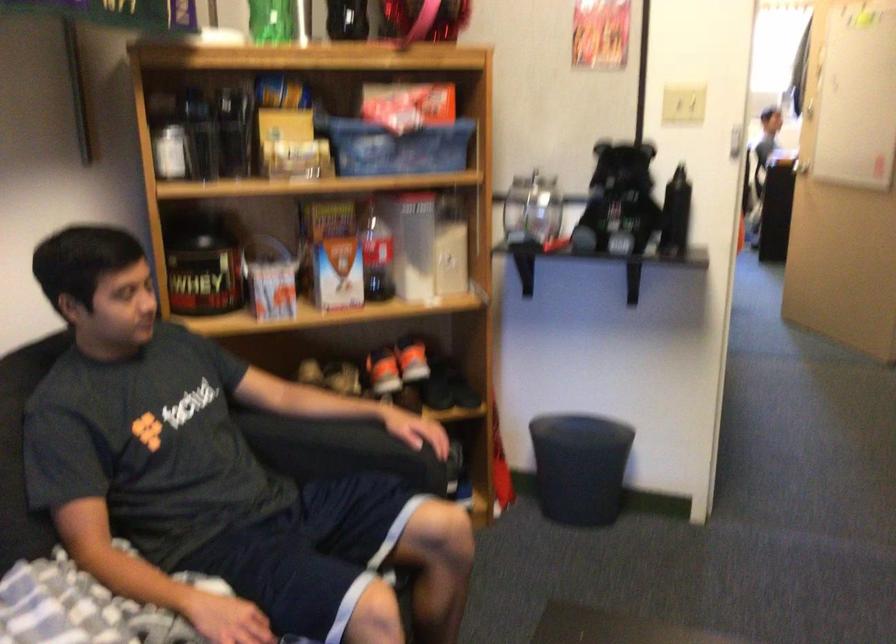
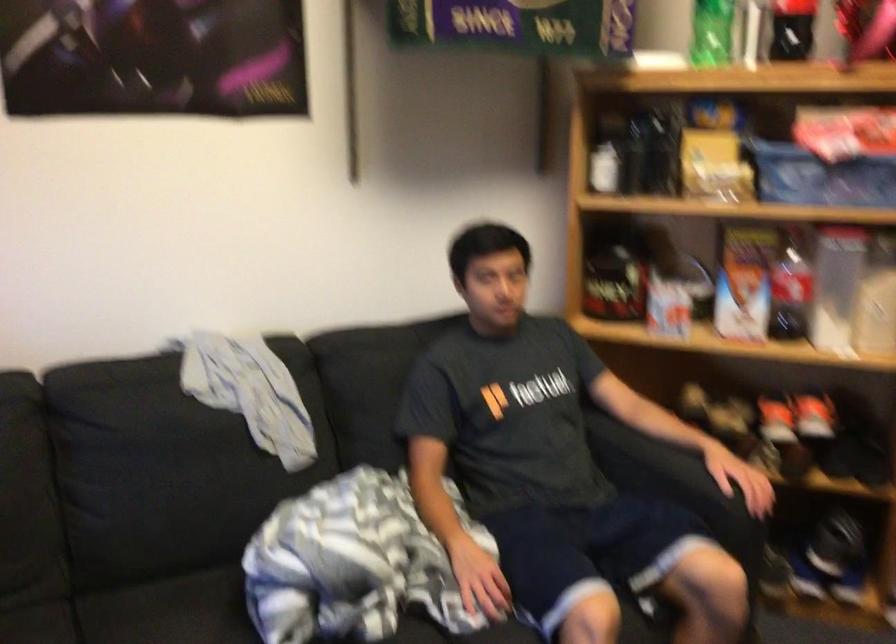
The point at [330,448] is marked in the first image. Where is the corresponding point in the second image?

(650, 464)